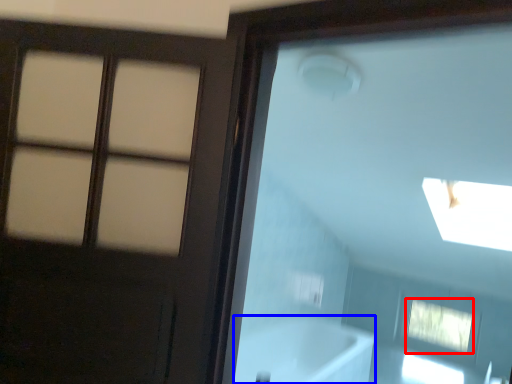
Question: Which point is further to the camera, window (highlighted by a red box) or bath (highlighted by a blue box)?

Choices:
 (A) window
 (B) bath

Answer: (A)